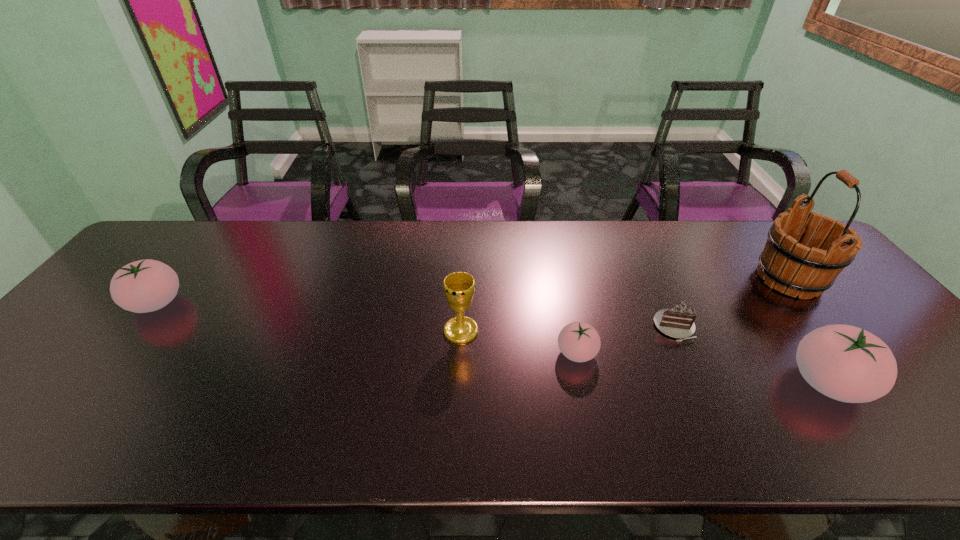
Locate an element on the screen. The width and height of the screenshot is (960, 540). vacant space located on the right of the third object from left to right is located at coordinates (754, 353).

I want to click on vacant space located on the right of the rightmost tomato, so click(x=888, y=383).

Locate an element on the screen. This screenshot has height=540, width=960. vacant region located 0.300m on the front of the tallest object is located at coordinates (888, 403).

You are a GUI agent. You are given a task and a screenshot of the screen. Output one action in this format:
    pyautogui.click(x=<x>, y=<y>)
    Task: Click on the free spot located 0.270m on the left of the chocolate cake
    Image resolution: width=960 pixels, height=540 pixels.
    Given the screenshot: What is the action you would take?
    pyautogui.click(x=550, y=327)

Where is `vacant space situated on the back of the second object from left to right`? The width and height of the screenshot is (960, 540). vacant space situated on the back of the second object from left to right is located at coordinates (x=463, y=294).

The height and width of the screenshot is (540, 960). I want to click on object at the far edge, so click(x=786, y=264).

This screenshot has height=540, width=960. I want to click on object that is at the near edge, so click(x=846, y=363).

Identify the location of object present at the left edge. Image resolution: width=960 pixels, height=540 pixels. click(x=147, y=285).

I want to click on object present at the right edge, so click(x=786, y=264).

At what (x,y) coordinates should I click in order to perform the action: click on object at the far right corner. Please return your answer as a coordinate pair (x, y). This screenshot has height=540, width=960. Looking at the image, I should click on (786, 264).